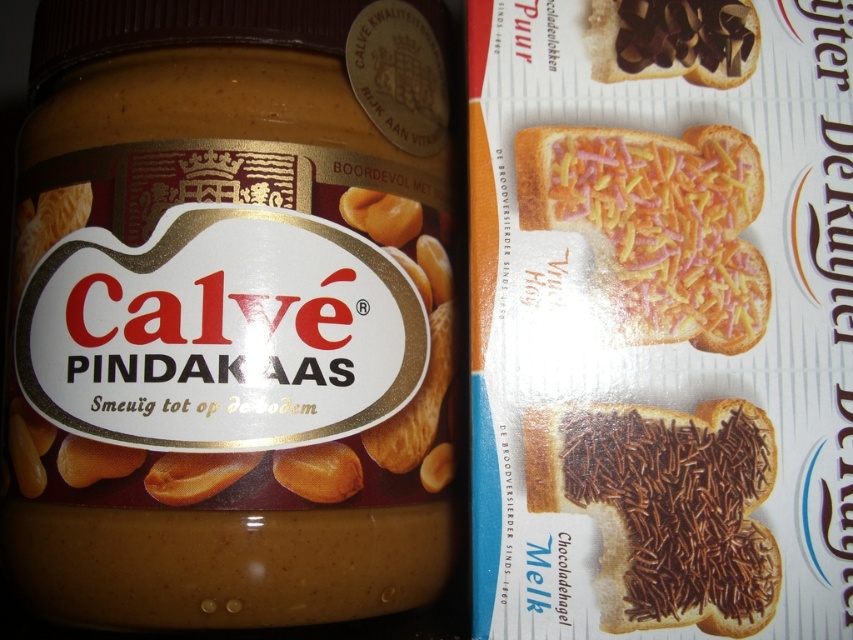
You are arranging items on a table for a breakfast display. You have a yellow sprinkled bread at center and a chocolate spread at upper right. According to the scene, where should you place the yellow sprinkled bread relative to the chocolate spread?

The yellow sprinkled bread at center should be placed below the chocolate spread at upper right as per the scene description.